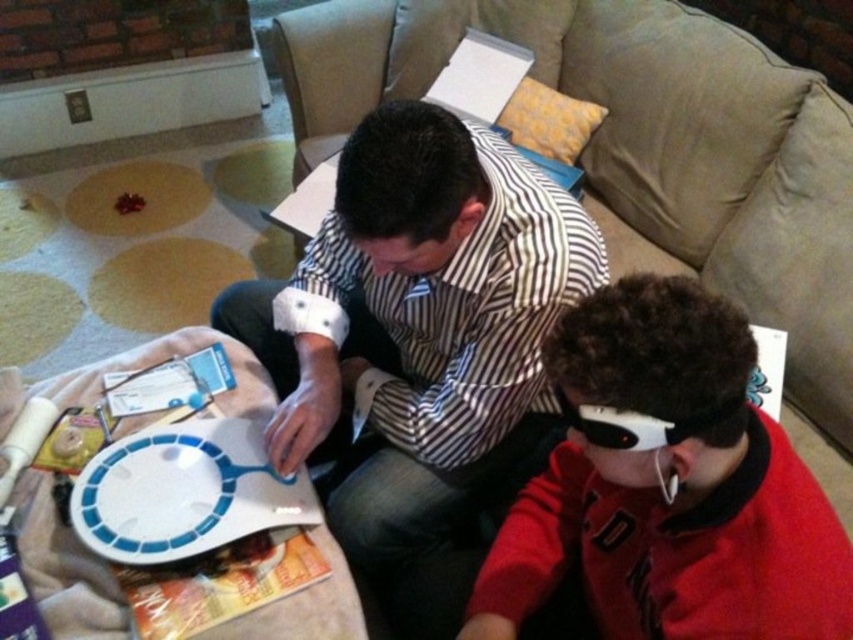
Does beige fabric couch at center appear on the right side of white plastic platter at center?

Yes, beige fabric couch at center is to the right of white plastic platter at center.

Based on the photo, who is lower down, beige fabric couch at center or white plastic platter at center?

white plastic platter at center is below.

Identify the location of beige fabric couch at center. The image size is (853, 640). (643, 147).

The image size is (853, 640). I want to click on beige fabric couch at center, so click(643, 147).

Consider the image. Who is positioned more to the right, striped fabric shirt at center or red matte glasses at center?

Positioned to the right is red matte glasses at center.

Between striped fabric shirt at center and red matte glasses at center, which one is positioned lower?

red matte glasses at center is lower down.

Where is `striped fabric shirt at center`? striped fabric shirt at center is located at coordinates (419, 332).

Does point (645, 8) come in front of point (602, 600)?

That is False.

Is beige fabric couch at center taller than red matte glasses at center?

Yes.

Who is more forward, (682, 180) or (646, 273)?

Positioned in front is point (646, 273).

Where is `beige fabric couch at center`? beige fabric couch at center is located at coordinates (643, 147).